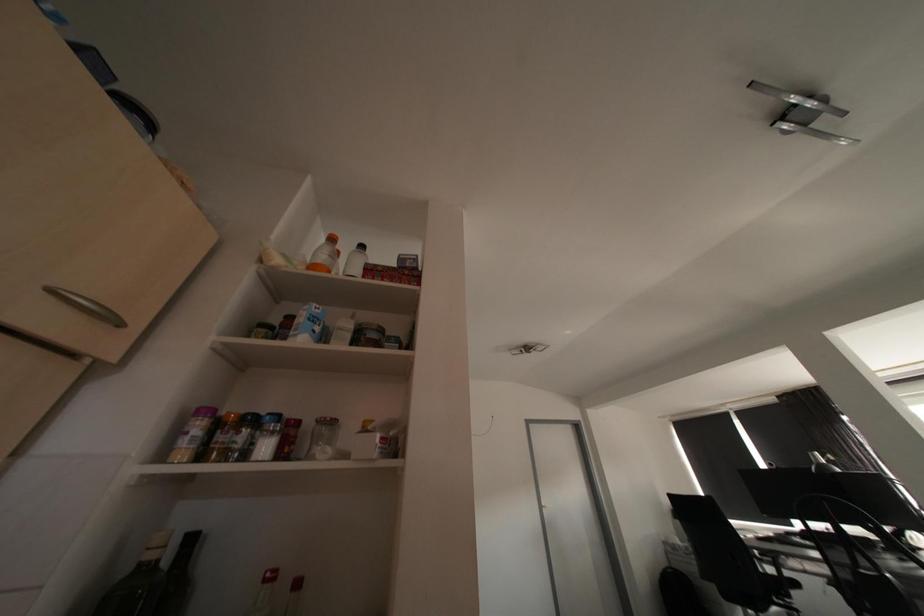
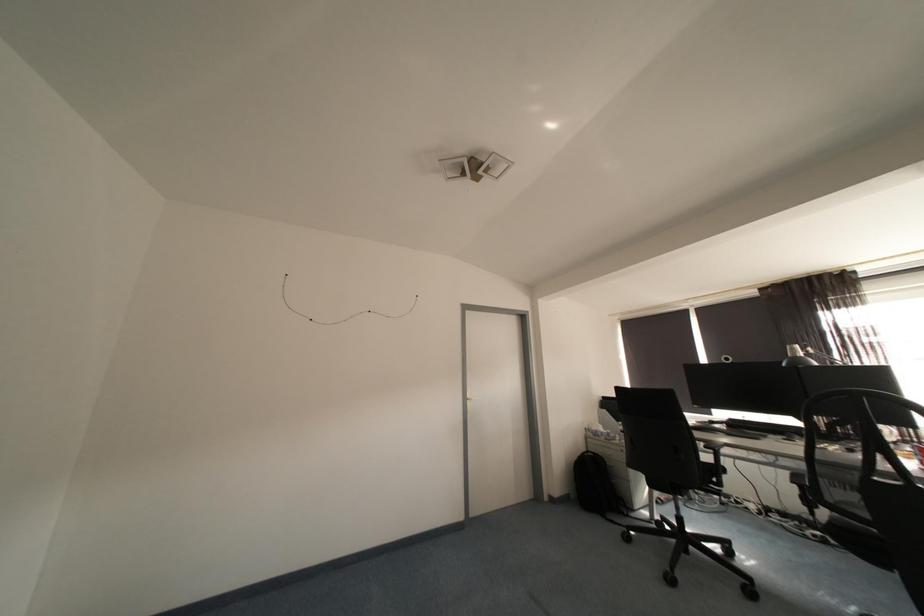
In the scene shown: In a continuous first-person perspective shot, in which direction is the camera moving?

The cameraman moved toward right, forward.